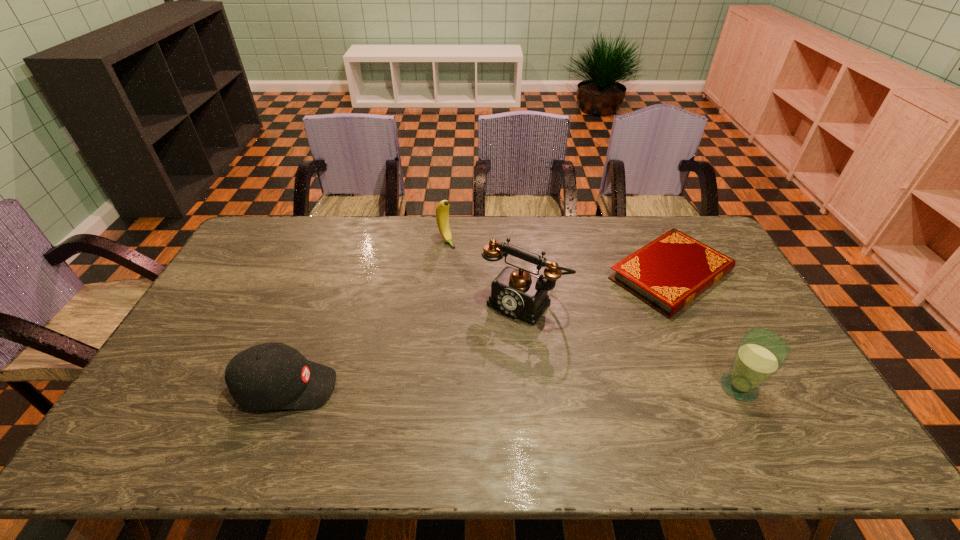
Image resolution: width=960 pixels, height=540 pixels. In order to click on the fourth tallest object in this screenshot , I will do `click(273, 375)`.

Locate an element on the screen. baseball cap is located at coordinates (273, 375).

You are a GUI agent. You are given a task and a screenshot of the screen. Output one action in this format:
    pyautogui.click(x=<x>, y=<y>)
    Task: Click on the glass
    
    Given the screenshot: What is the action you would take?
    pyautogui.click(x=761, y=353)

Identify the location of the third object from left to right. This screenshot has width=960, height=540. (515, 292).

Find the location of a particular element. The height and width of the screenshot is (540, 960). telephone is located at coordinates (515, 292).

Where is `the second object from left to right`? The height and width of the screenshot is (540, 960). the second object from left to right is located at coordinates (442, 210).

This screenshot has height=540, width=960. In order to click on the shortest object in this screenshot , I will do `click(668, 273)`.

Where is `vacant region located 0.340m with a logo on the front of the second shortest object`? Image resolution: width=960 pixels, height=540 pixels. vacant region located 0.340m with a logo on the front of the second shortest object is located at coordinates (467, 388).

Image resolution: width=960 pixels, height=540 pixels. What are the coordinates of `vacant space located 0.200m on the back of the glass` in the screenshot? It's located at (703, 317).

Find the location of `free space located 0.140m on the front of the tallest object at the rotary dial`. free space located 0.140m on the front of the tallest object at the rotary dial is located at coordinates (477, 354).